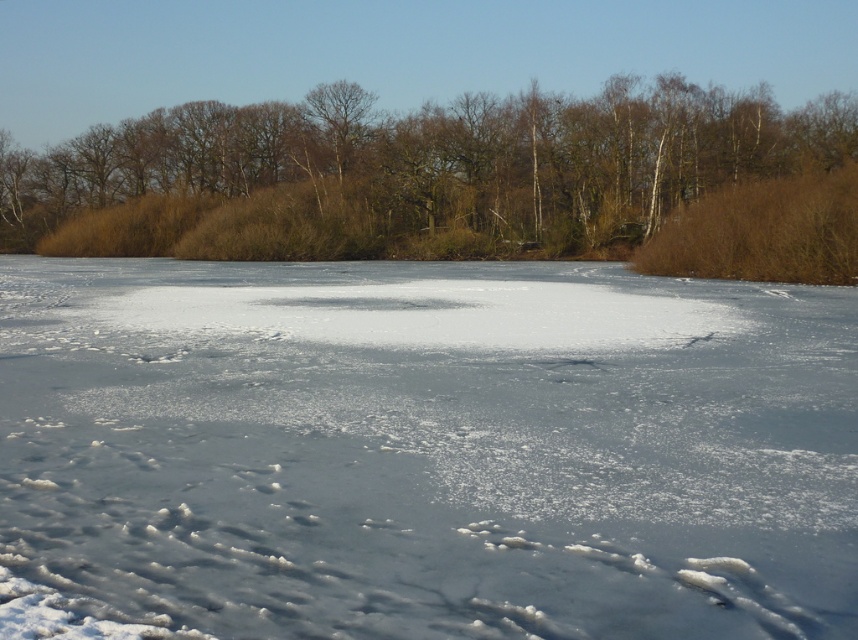
Is white frosty ice at center positioned in front of brown/dry grass at upper center?

That is True.

Between point (29, 401) and point (753, 97), which one is positioned behind?

The point (753, 97) is more distant.

Locate an element on the screen. This screenshot has width=858, height=640. white frosty ice at center is located at coordinates (421, 451).